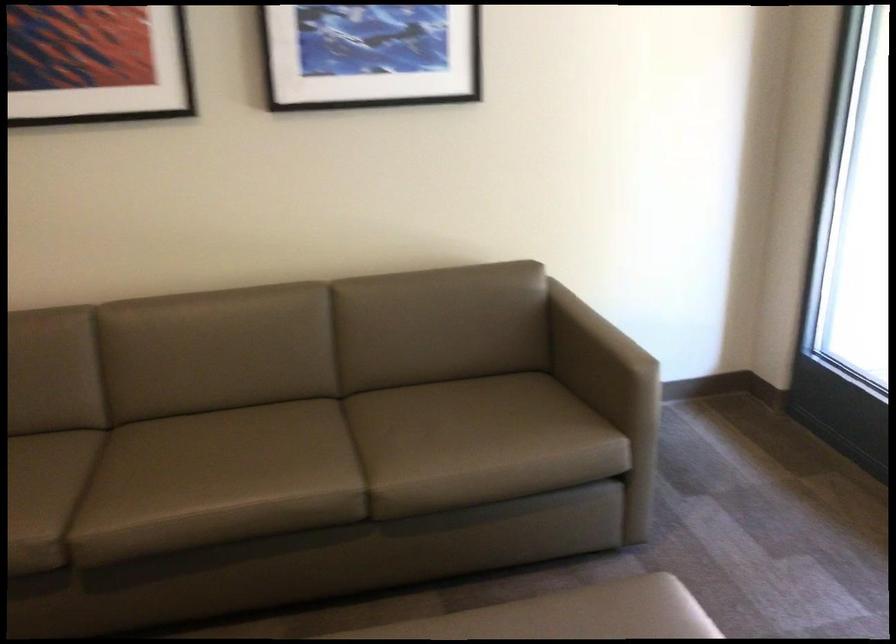
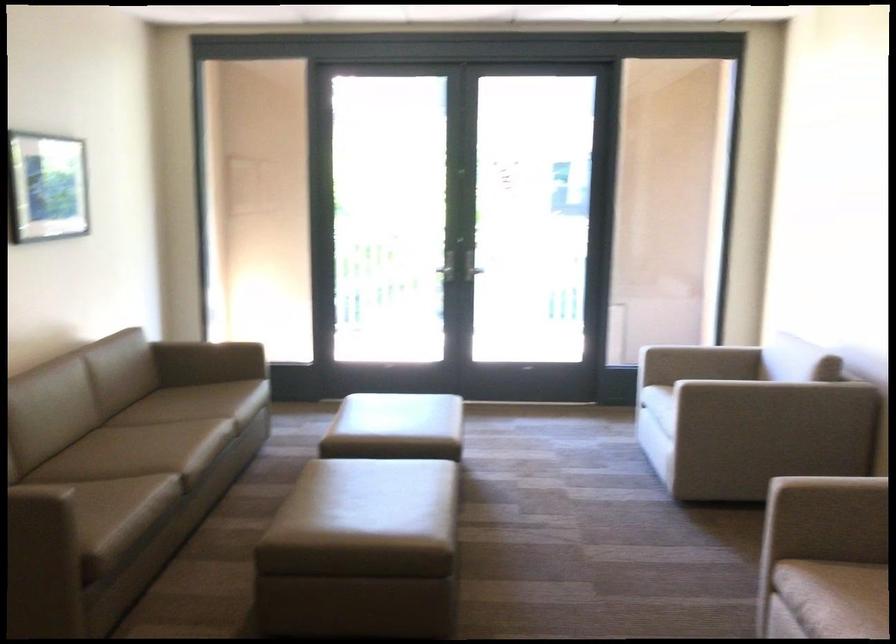
Where in the second image is the point corresponding to the point at 597,618 from the first image?

(349, 397)